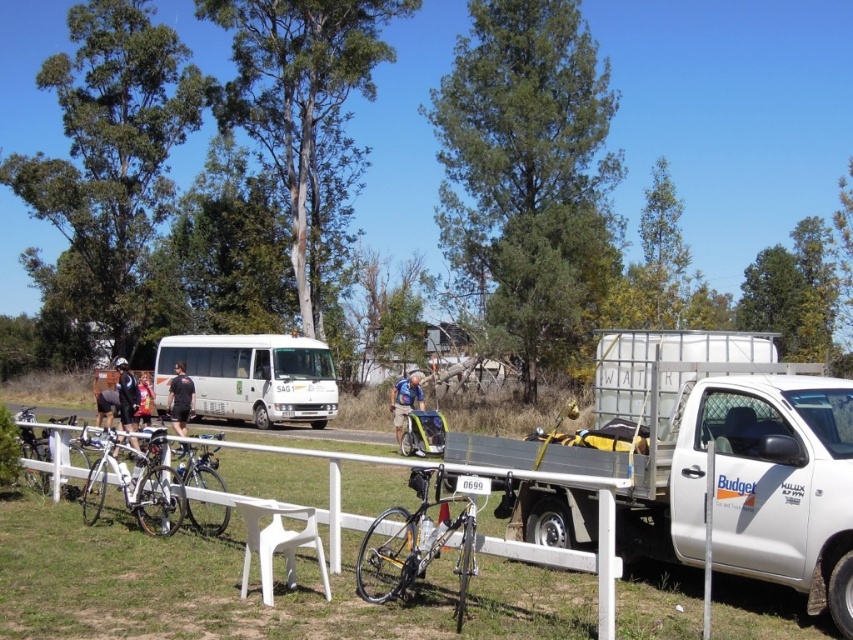
Is white metallic trailer truck at right taller than white plastic fence at lower center?

In fact, white metallic trailer truck at right may be shorter than white plastic fence at lower center.

Does white metallic trailer truck at right lie behind white plastic fence at lower center?

Yes, white metallic trailer truck at right is further from the viewer.

Locate an element on the screen. The image size is (853, 640). white metallic trailer truck at right is located at coordinates (714, 458).

Is point (608, 515) positioned in front of point (160, 490)?

That is True.

Does white plastic fence at lower center appear on the left side of shiny silver bicycle at left?

Incorrect, white plastic fence at lower center is not on the left side of shiny silver bicycle at left.

Locate an element on the screen. The width and height of the screenshot is (853, 640). white plastic fence at lower center is located at coordinates (573, 548).

Can you confirm if silver metallic bicycle at left is positioned below black fabric shorts at center?

Indeed, silver metallic bicycle at left is positioned under black fabric shorts at center.

Who is more distant from viewer, [45,472] or [183,385]?

The point [183,385] is more distant.

Who is more forward, (30, 438) or (177, 396)?

Positioned in front is point (30, 438).

At what (x,y) coordinates should I click in order to perform the action: click on silver metallic bicycle at left. Please return your answer as a coordinate pair (x, y). The width and height of the screenshot is (853, 640). Looking at the image, I should click on (33, 444).